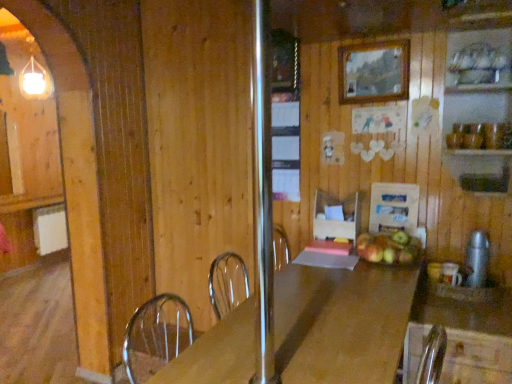
Question: From a real-world perspective, is wooden table at center positioned above or below wooden countertop at right?

Choices:
 (A) above
 (B) below

Answer: (B)

Question: Is point (308, 307) closer or farther from the camera than point (465, 377)?

Choices:
 (A) farther
 (B) closer

Answer: (B)

Question: Considering the real-world distances, which object is farthest from the wooden picture frame at upper center?

Choices:
 (A) wooden table at center
 (B) wooden countertop at right
 (C) green matte apples at center
 (D) satin silver thermos at right, positioned as the second appliance in back-to-front order
 (E) wooden cutting board at center, marked as the 2th appliance in a right-to-left arrangement

Answer: (A)

Question: Estimate the real-world distances between objects in this image. Which object is farther from the wooden picture frame at upper center?

Choices:
 (A) green matte apples at center
 (B) wooden cutting board at center, which is counted as the 1th appliance, starting from the left
 (C) satin silver thermos at right, which is the second appliance from left to right
 (D) wooden countertop at right
 (E) wooden table at center

Answer: (E)